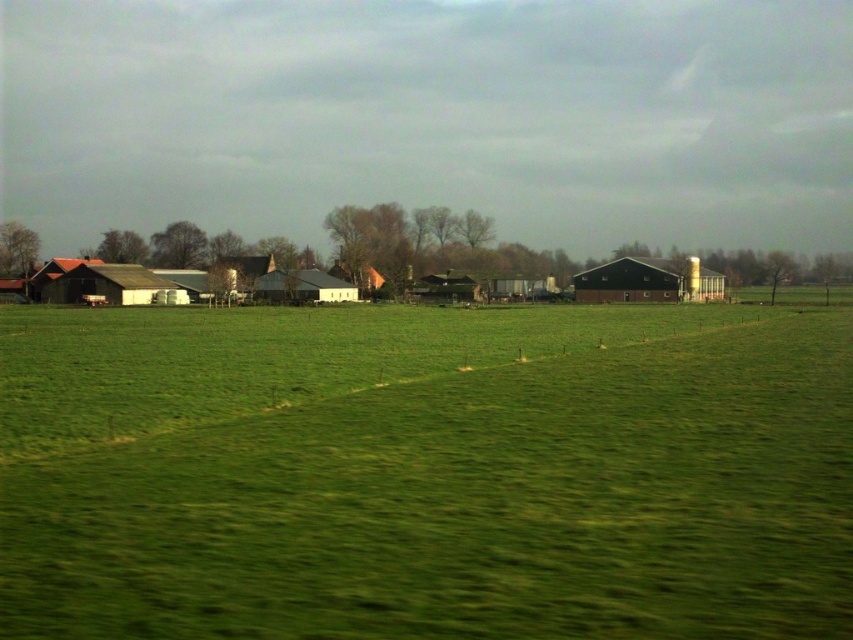
You are a farmer planning to store hay in both the matte white barn at left and the wooden barn at center. Which barn has more space for storing hay?

The matte white barn at left has a larger size compared to the wooden barn at center, so it has more space for storing hay.

You are standing in the rural landscape and want to take a photo. There are two points marked in the scene, point 1 at coordinates point (59, 468) and point 2 at point (614, 289). Which point will appear larger in your camera view?

Point 1 at coordinates point (59, 468) will appear larger in the camera view because it is closer to the camera than point 2 at point (614, 289).

From the picture: You are standing in the rural landscape scene and want to determine which of the two points, point (x=96, y=269) or point (x=457, y=289), is nearer to you. Based on the image, which point is closer?

Point (x=96, y=269) is closer to the camera than point (x=457, y=289), so it is the nearer one.